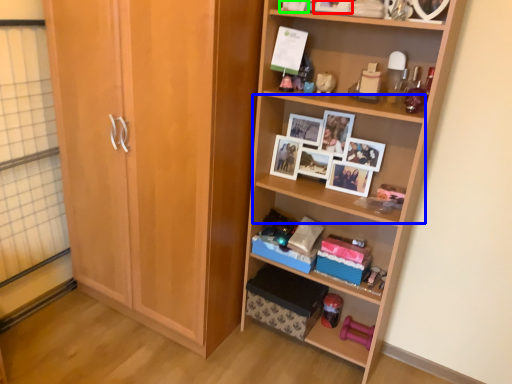
Question: Which is farther away from picture frame (highlighted by a red box)? shelf (highlighted by a blue box) or toy (highlighted by a green box)?

Choices:
 (A) shelf
 (B) toy

Answer: (A)